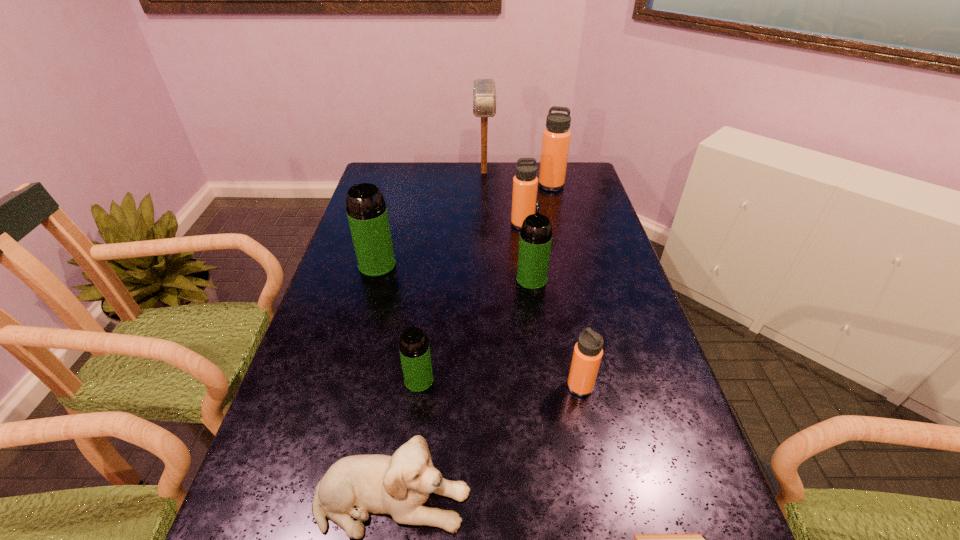
Locate an element on the screen. free space between the smallest green thermos bottle and the second smallest orange thermos bottle is located at coordinates (470, 302).

What are the coordinates of `vacant area between the mallet and the leftmost thermos bottle` in the screenshot? It's located at (431, 219).

Where is `empty space that is in between the fifth nearest thermos bottle and the leftmost thermos bottle`? empty space that is in between the fifth nearest thermos bottle and the leftmost thermos bottle is located at coordinates (450, 245).

Where is `object that is the closest to the diary`? object that is the closest to the diary is located at coordinates (587, 355).

Image resolution: width=960 pixels, height=540 pixels. Identify the location of the fourth closest object to the leftmost green thermos bottle. (484, 90).

Identify the location of thermos bottle that can be found as the second closest to the second shortest object. The height and width of the screenshot is (540, 960). (587, 355).

You are a GUI agent. You are given a task and a screenshot of the screen. Output one action in this format:
    pyautogui.click(x=<x>, y=<y>)
    Task: Click on the thermos bottle that stands as the closest to the nearest orange thermos bottle
    The height and width of the screenshot is (540, 960).
    Given the screenshot: What is the action you would take?
    pyautogui.click(x=535, y=240)

Identify which green thermos bottle is located as the nearest to the second biggest green thermos bottle. Please provide its 2D coordinates. Your answer should be formatted as a tuple, i.e. [(x, y)], where the tuple contains the x and y coordinates of a point satisfying the conditions above.

[(414, 349)]

Locate which green thermos bottle is the third closest to the nearest orange thermos bottle. Please provide its 2D coordinates. Your answer should be formatted as a tuple, i.e. [(x, y)], where the tuple contains the x and y coordinates of a point satisfying the conditions above.

[(366, 209)]

Point out which orange thermos bottle is positioned as the third nearest to the rightmost green thermos bottle. Please provide its 2D coordinates. Your answer should be formatted as a tuple, i.e. [(x, y)], where the tuple contains the x and y coordinates of a point satisfying the conditions above.

[(556, 136)]